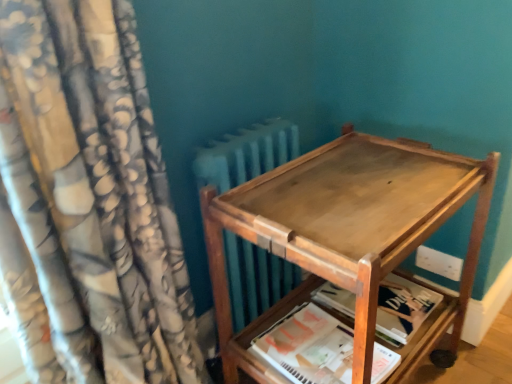
This screenshot has height=384, width=512. Describe the element at coordinates (308, 347) in the screenshot. I see `white paper at lower center, the second paperback book when ordered from back to front` at that location.

Find the location of a particular element. This screenshot has width=512, height=384. floral fabric curtain at left is located at coordinates point(88,203).

The image size is (512, 384). Describe the element at coordinates (349, 237) in the screenshot. I see `wooden tray at center` at that location.

Find the location of a particular element. wooden paperback book at lower right, which is the second paperback book in front-to-back order is located at coordinates (403, 308).

This screenshot has width=512, height=384. Describe the element at coordinates (403, 308) in the screenshot. I see `wooden paperback book at lower right, which is the second paperback book in front-to-back order` at that location.

At what (x,y) coordinates should I click in order to perform the action: click on white paper at lower center, the second paperback book when ordered from back to front. Please return your answer as a coordinate pair (x, y). Looking at the image, I should click on (308, 347).

Looking at their sizes, would you say wooden tray at center is wider or thinner than floral fabric curtain at left?

In the image, wooden tray at center appears to be more narrow than floral fabric curtain at left.

Who is taller, wooden tray at center or floral fabric curtain at left?

floral fabric curtain at left is taller.

Would you say wooden tray at center is to the left or to the right of floral fabric curtain at left in the picture?

Clearly, wooden tray at center is on the right of floral fabric curtain at left in the image.

Find the location of a particular element. This screenshot has width=512, height=384. curtain that appears above the wooden tray at center (from the image's perspective) is located at coordinates (88, 203).

Is wooden paperback book at lower right, which is the second paperback book in front-to-back order, beside floral fabric curtain at left?

No, wooden paperback book at lower right, which is the second paperback book in front-to-back order, is not making contact with floral fabric curtain at left.

Is point (340, 307) positioned in front of point (143, 338)?

No, it is not.

In the image, is wooden paperback book at lower right, which is the second paperback book in front-to-back order, positioned in front of or behind floral fabric curtain at left?

wooden paperback book at lower right, which is the second paperback book in front-to-back order, is behind floral fabric curtain at left.

Does wooden paperback book at lower right, the first paperback book viewed from the back, have a lesser width compared to floral fabric curtain at left?

Correct, the width of wooden paperback book at lower right, the first paperback book viewed from the back, is less than that of floral fabric curtain at left.

Is point (293, 225) closer to viewer compared to point (298, 327)?

Yes, it is in front of point (298, 327).

Based on their sizes in the image, would you say wooden tray at center is bigger or smaller than white paper at lower center, marked as the 1th paperback book in a front-to-back arrangement?

Clearly, wooden tray at center is larger in size than white paper at lower center, marked as the 1th paperback book in a front-to-back arrangement.

From a real-world perspective, relative to white paper at lower center, marked as the 1th paperback book in a front-to-back arrangement, is wooden tray at center vertically above or below?

From a real-world perspective, wooden tray at center is physically above white paper at lower center, marked as the 1th paperback book in a front-to-back arrangement.

From the image's perspective, which object appears higher, wooden tray at center or white paper at lower center, marked as the 1th paperback book in a front-to-back arrangement?

From the image's view, wooden tray at center is above.

Where is `paperback book that is the 2nd object directly below the floral fabric curtain at left (from a real-world perspective)`? The height and width of the screenshot is (384, 512). paperback book that is the 2nd object directly below the floral fabric curtain at left (from a real-world perspective) is located at coordinates (403, 308).

Is floral fabric curtain at left situated inside wooden paperback book at lower right, the first paperback book viewed from the back, or outside?

floral fabric curtain at left is spatially situated outside wooden paperback book at lower right, the first paperback book viewed from the back.

Is the position of floral fabric curtain at left more distant than that of wooden paperback book at lower right, the first paperback book viewed from the back?

No, the depth of floral fabric curtain at left is less than that of wooden paperback book at lower right, the first paperback book viewed from the back.

Which object is further away from the camera, wooden paperback book at lower right, which is the second paperback book in front-to-back order, or wooden tray at center?

wooden paperback book at lower right, which is the second paperback book in front-to-back order, is further away from the camera.

Can you confirm if wooden paperback book at lower right, the first paperback book viewed from the back, is shorter than wooden tray at center?

Correct, wooden paperback book at lower right, the first paperback book viewed from the back, is not as tall as wooden tray at center.

Does point (420, 323) lie behind point (221, 215)?

That is True.

I want to click on furniture above the wooden paperback book at lower right, the first paperback book viewed from the back (from the image's perspective), so click(x=349, y=237).

Who is taller, floral fabric curtain at left or wooden tray at center?

Standing taller between the two is floral fabric curtain at left.

Which is behind, floral fabric curtain at left or wooden tray at center?

Positioned behind is wooden tray at center.

Would you say floral fabric curtain at left is outside wooden tray at center?

Yes.

From the image's perspective, which one is positioned lower, white paper at lower center, the second paperback book when ordered from back to front, or wooden tray at center?

white paper at lower center, the second paperback book when ordered from back to front, is shown below in the image.

From a real-world perspective, does white paper at lower center, the second paperback book when ordered from back to front, sit lower than wooden tray at center?

Yes.

Does point (393, 369) lie behind point (416, 191)?

That is True.

Is the surface of white paper at lower center, marked as the 1th paperback book in a front-to-back arrangement, in direct contact with wooden tray at center?

No, white paper at lower center, marked as the 1th paperback book in a front-to-back arrangement, is not touching wooden tray at center.

The image size is (512, 384). Find the location of `curtain in front of the wooden tray at center`. curtain in front of the wooden tray at center is located at coordinates (88, 203).

Find the location of a particular element. paperback book that is the 2nd object to the right of the floral fabric curtain at left, starting at the anchor is located at coordinates (403, 308).

Looking at the image, which one is located closer to floral fabric curtain at left, wooden tray at center or wooden paperback book at lower right, the first paperback book viewed from the back?

wooden tray at center.

Which object lies further to the anchor point wooden paperback book at lower right, which is the second paperback book in front-to-back order, floral fabric curtain at left or white paper at lower center, marked as the 1th paperback book in a front-to-back arrangement?

floral fabric curtain at left is positioned further to the anchor wooden paperback book at lower right, which is the second paperback book in front-to-back order.

In the scene shown: Looking at the image, which one is located further to floral fabric curtain at left, wooden paperback book at lower right, the first paperback book viewed from the back, or white paper at lower center, the second paperback book when ordered from back to front?

wooden paperback book at lower right, the first paperback book viewed from the back, is further to floral fabric curtain at left.

Which object lies nearer to the anchor point floral fabric curtain at left, wooden tray at center or white paper at lower center, the second paperback book when ordered from back to front?

wooden tray at center is closer to floral fabric curtain at left.

Which object lies further to the anchor point wooden paperback book at lower right, which is the second paperback book in front-to-back order, white paper at lower center, marked as the 1th paperback book in a front-to-back arrangement, or floral fabric curtain at left?

floral fabric curtain at left is positioned further to the anchor wooden paperback book at lower right, which is the second paperback book in front-to-back order.

Estimate the real-world distances between objects in this image. Which object is further from floral fabric curtain at left, white paper at lower center, marked as the 1th paperback book in a front-to-back arrangement, or wooden paperback book at lower right, the first paperback book viewed from the back?

Based on the image, wooden paperback book at lower right, the first paperback book viewed from the back, appears to be further to floral fabric curtain at left.

Which object lies nearer to the anchor point floral fabric curtain at left, white paper at lower center, marked as the 1th paperback book in a front-to-back arrangement, or wooden tray at center?

wooden tray at center is closer to floral fabric curtain at left.

Looking at the image, which one is located closer to wooden tray at center, floral fabric curtain at left or wooden paperback book at lower right, the first paperback book viewed from the back?

Among the two, wooden paperback book at lower right, the first paperback book viewed from the back, is located nearer to wooden tray at center.

This screenshot has height=384, width=512. Identify the location of paperback book located between floral fabric curtain at left and wooden tray at center in the left-right direction. (308, 347).

I want to click on furniture between floral fabric curtain at left and wooden paperback book at lower right, which is the second paperback book in front-to-back order, in the horizontal direction, so click(x=349, y=237).

Where is `paperback book between wooden tray at center and wooden paperback book at lower right, which is the second paperback book in front-to-back order, from front to back`? This screenshot has width=512, height=384. paperback book between wooden tray at center and wooden paperback book at lower right, which is the second paperback book in front-to-back order, from front to back is located at coordinates (308, 347).

You are a GUI agent. You are given a task and a screenshot of the screen. Output one action in this format:
    pyautogui.click(x=<x>, y=<y>)
    Task: Click on the paperback book between floral fabric curtain at left and wooden paperback book at lower right, the first paperback book viewed from the back, along the z-axis
    
    Given the screenshot: What is the action you would take?
    pyautogui.click(x=308, y=347)